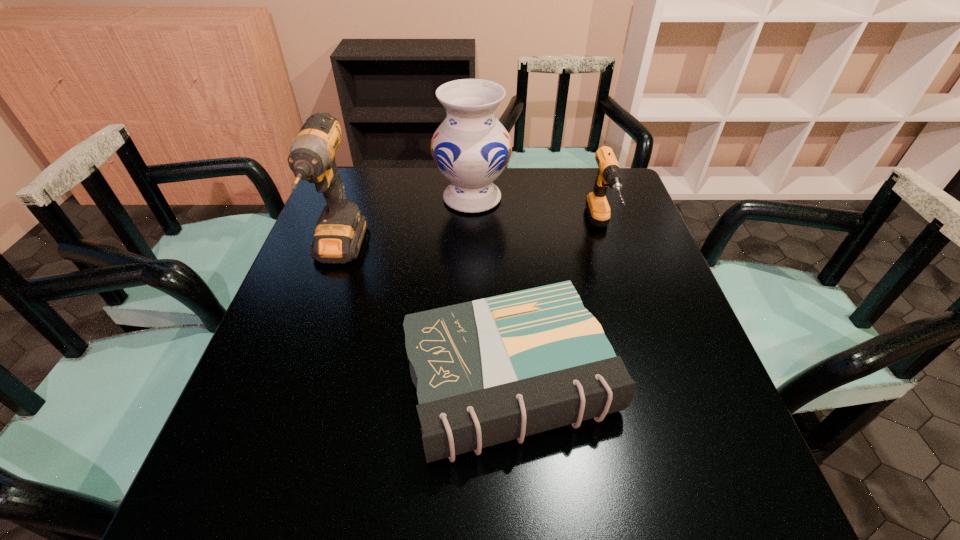
Locate an element on the screen. Image resolution: width=960 pixels, height=540 pixels. object that is the second closest one to the nearest object is located at coordinates (340, 230).

Where is `object that stands as the closest to the nearest object`? The image size is (960, 540). object that stands as the closest to the nearest object is located at coordinates (609, 174).

Identify the location of vacant space that satisfies the following two spatial constraints: 1. on the front side of the vase; 2. on the left side of the shortest object. The width and height of the screenshot is (960, 540). (468, 379).

This screenshot has width=960, height=540. Find the location of `free spot that satisfies the following two spatial constraints: 1. with the drill bit of the left drill facing forward; 2. on the left side of the shortest object`. free spot that satisfies the following two spatial constraints: 1. with the drill bit of the left drill facing forward; 2. on the left side of the shortest object is located at coordinates (294, 379).

This screenshot has width=960, height=540. I want to click on free spot that satisfies the following two spatial constraints: 1. with the drill bit of the shortest object facing forward; 2. on the right side of the left drill, so click(x=294, y=379).

At what (x,y) coordinates should I click in order to perform the action: click on vacant position in the image that satisfies the following two spatial constraints: 1. with the drill bit of the nearest object facing forward; 2. on the right side of the leftmost object. Please return your answer as a coordinate pair (x, y). The height and width of the screenshot is (540, 960). Looking at the image, I should click on coord(294,379).

This screenshot has width=960, height=540. I want to click on vacant area in the image that satisfies the following two spatial constraints: 1. with the drill bit of the left drill facing forward; 2. on the right side of the nearest object, so [294, 379].